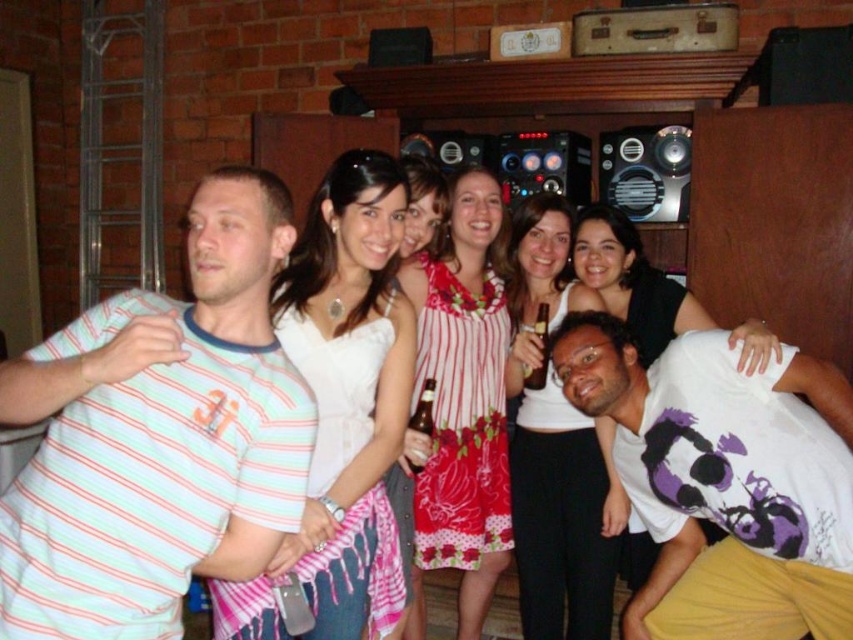
You are a photographer standing in front of the white satin dress at center. You want to take a photo of it but need to be at least 6 feet away to avoid blurring. Can you do it?

The distance between you and the white satin dress at center is 5.09 feet, which is less than the required 6 feet. Therefore, you cannot take the photo without risking blurring.

Looking at this image, you are a photographer trying to capture a closeup shot of the white satin dress at center and the white matte tank top at center. The camera you are using has a maximum focus range of 24 inches. Will you be able to focus on both items simultaneously?

The white satin dress at center and white matte tank top at center are 23.89 inches apart from each other. Since the distance between them is less than the camera maximum focus range of 24 inches, the photographer can focus on both items simultaneously.

You are a photographer at the event and want to capture a photo that includes both the striped cotton shirt at left and the white lace dress at center. Based on their positions, which one should you focus on first to ensure both are in frame?

The striped cotton shirt at left is located above the white lace dress at center, so you should focus on the white lace dress at center first to ensure both are in frame.